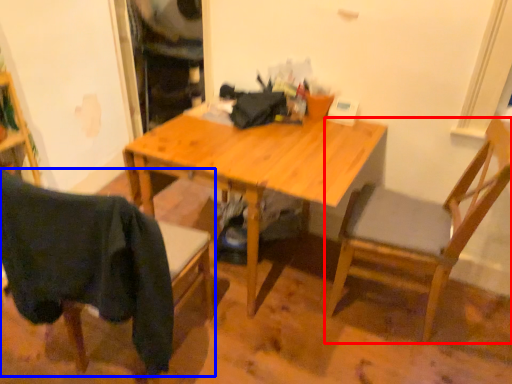
Question: Which object is further to the camera taking this photo, chair (highlighted by a red box) or chair (highlighted by a blue box)?

Choices:
 (A) chair
 (B) chair

Answer: (A)